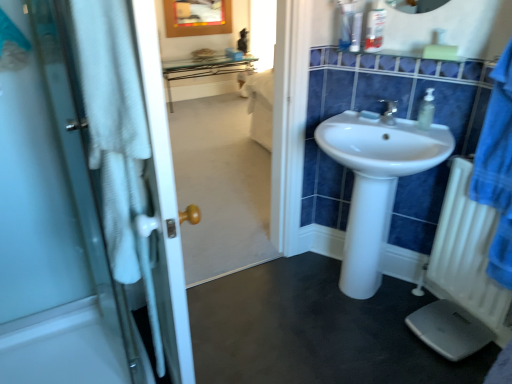
The width and height of the screenshot is (512, 384). What are the coordinates of `vacant space situated on the left part of white plastic scale at lower right` in the screenshot? It's located at (392, 337).